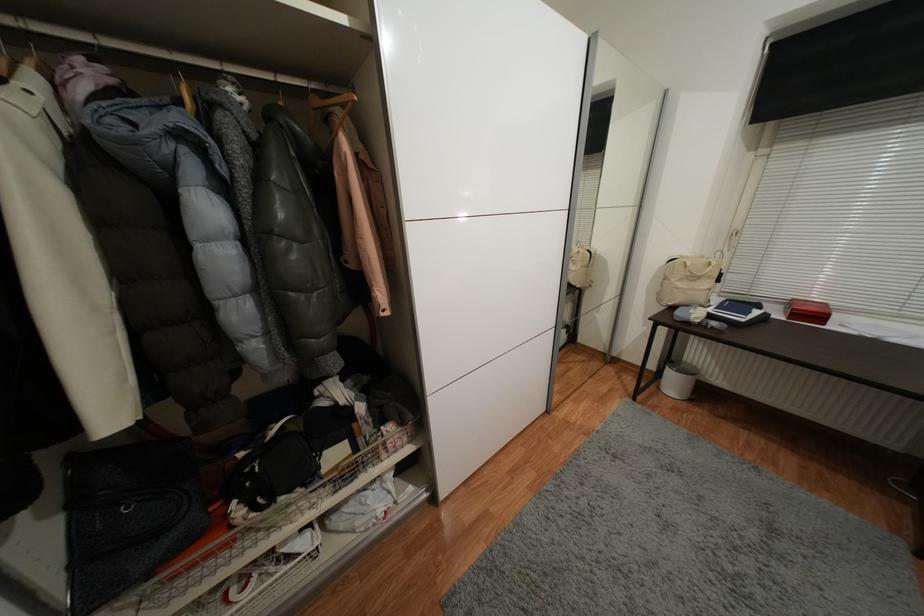
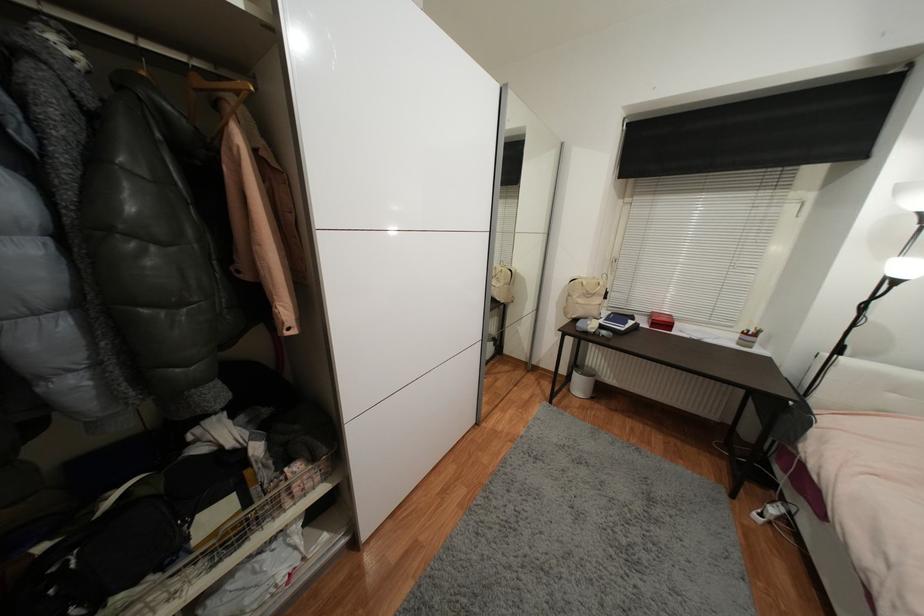
Question: The first image is from the beginning of the video and the second image is from the end. How did the camera likely rotate when shooting the video?

Choices:
 (A) Left
 (B) Right
 (C) Up
 (D) Down

Answer: (B)